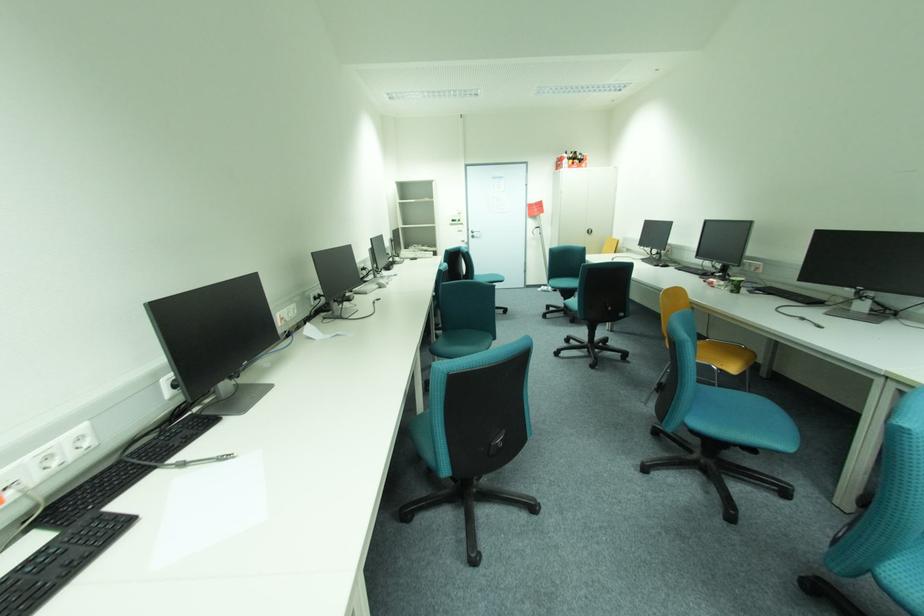
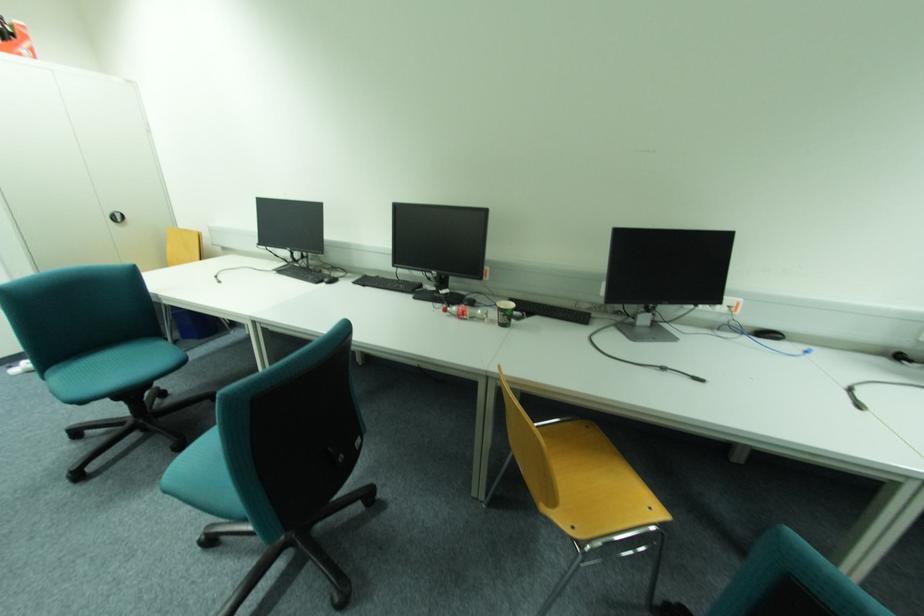
Locate, in the second image, the point that corresponds to point (711, 282) in the first image.

(451, 310)